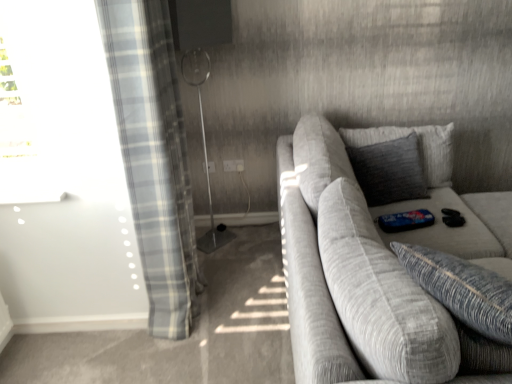
Question: Is textured gray couch at right to the left of light blue plaid curtain at left from the viewer's perspective?

Choices:
 (A) yes
 (B) no

Answer: (B)

Question: Is textured gray couch at right further to camera compared to light blue plaid curtain at left?

Choices:
 (A) yes
 (B) no

Answer: (B)

Question: Is textured gray couch at right far from light blue plaid curtain at left?

Choices:
 (A) no
 (B) yes

Answer: (A)

Question: Does textured gray couch at right have a lesser height compared to light blue plaid curtain at left?

Choices:
 (A) yes
 (B) no

Answer: (A)

Question: Considering the relative sizes of textured gray couch at right and light blue plaid curtain at left in the image provided, is textured gray couch at right bigger than light blue plaid curtain at left?

Choices:
 (A) yes
 (B) no

Answer: (A)

Question: Is textured gray couch at right to the right of light blue plaid curtain at left from the viewer's perspective?

Choices:
 (A) yes
 (B) no

Answer: (A)

Question: From the image's perspective, is light blue plaid curtain at left located beneath textured gray pillow at upper right?

Choices:
 (A) yes
 (B) no

Answer: (A)

Question: Can you confirm if light blue plaid curtain at left is positioned to the right of textured gray pillow at upper right?

Choices:
 (A) no
 (B) yes

Answer: (A)

Question: Is light blue plaid curtain at left aimed at textured gray pillow at upper right?

Choices:
 (A) no
 (B) yes

Answer: (B)

Question: From a real-world perspective, is light blue plaid curtain at left positioned under textured gray pillow at upper right based on gravity?

Choices:
 (A) no
 (B) yes

Answer: (A)

Question: Is light blue plaid curtain at left bigger than textured gray pillow at upper right?

Choices:
 (A) no
 (B) yes

Answer: (B)

Question: Would you say light blue plaid curtain at left contains textured gray pillow at upper right?

Choices:
 (A) yes
 (B) no

Answer: (B)

Question: Is light blue plaid curtain at left turned away from textured gray couch at right?

Choices:
 (A) yes
 (B) no

Answer: (B)